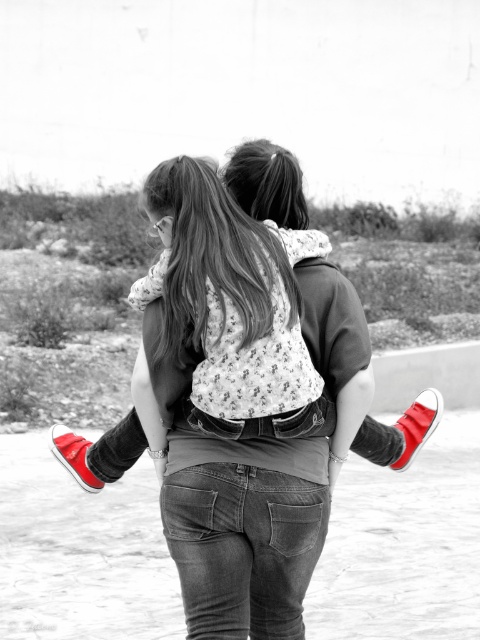
Question: Which of the following is the closest to the observer?

Choices:
 (A) matte black shirt at center
 (B) floral fabric dress at center

Answer: (A)

Question: Does matte black shirt at center appear on the right side of floral fabric dress at center?

Choices:
 (A) no
 (B) yes

Answer: (B)

Question: Is matte black shirt at center bigger than floral fabric dress at center?

Choices:
 (A) no
 (B) yes

Answer: (B)

Question: Which object is closer to the camera taking this photo?

Choices:
 (A) matte black shirt at center
 (B) floral fabric dress at center

Answer: (A)

Question: Where is matte black shirt at center located in relation to floral fabric dress at center in the image?

Choices:
 (A) right
 (B) left

Answer: (A)